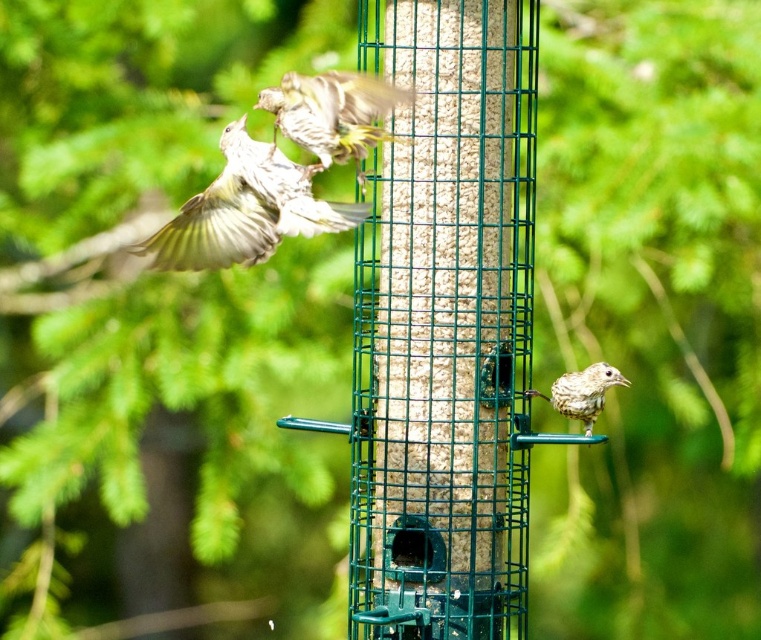
Consider the image. You are a birdwatcher observing the bird feeder. You notice two brown speckled objects in the scene. One is labeled as brown speckled feathers at upper left and the other as brown speckled bird at lower right. Which object has a greater width?

The brown speckled feathers at upper left has a greater width than the brown speckled bird at lower right according to the description.

You are a bird enthusiast observing the bird feeder. You notice two birds with brown speckled feathers at upper left and brown speckled feathers at upper center. Which bird has a wider body?

The brown speckled feathers at upper left might be wider than brown speckled feathers at upper center according to the description.

You are a birdwatcher observing the bird feeder scene. You notice a point at coordinates (333, 113). What can you see at this point?

At point (333, 113), there are brown speckled feathers at upper center.